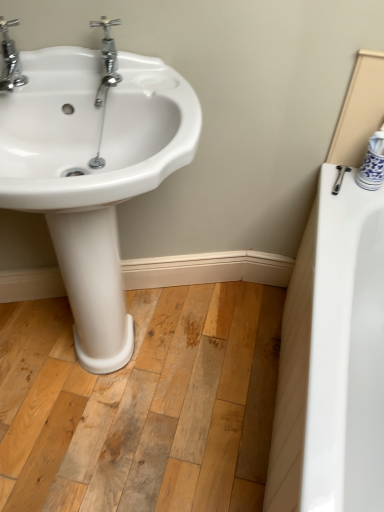
Locate an element on the screen. vacant space situated on the left part of chrome/metallic faucet at upper left, the 2th tap in the left-to-right sequence is located at coordinates (63, 77).